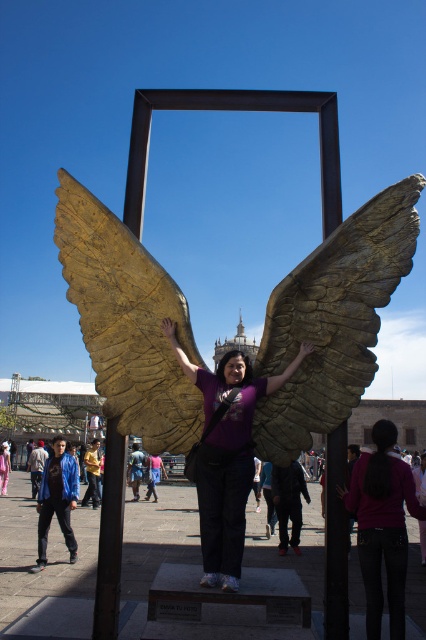
You are a fashion designer observing a person wearing a purple matte shirt at center and blue denim jeans at center. Which clothing item is wider?

The purple matte shirt at center is wider than the blue denim jeans at center.

You are a tour guide explaining the gold textured wings at center to a group. You mention that two important landmarks are exactly 138.17 feet apart from each other. Which two landmarks are you referring to?

The two landmarks that are 138.17 feet apart are the gold textured wings at center and the distant building with a dome.